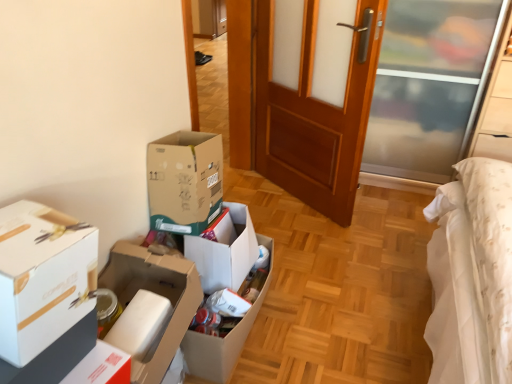
Measure the distance between white cardboard box at center, positioned as the 2th box in back-to-front order, and camera.

They are 1.10 meters apart.

Identify the location of white cardboard box at center, the second box when ordered from front to back. (150, 306).

Could you tell me if white cardboard box at left, which is the third box in back-to-front order, is facing white cardboard box at center, positioned as the 2th box in back-to-front order?

No, white cardboard box at left, which is the third box in back-to-front order, is not oriented towards white cardboard box at center, positioned as the 2th box in back-to-front order.

Considering the positions of objects white cardboard box at left, the first box from the front, and white cardboard box at center, the second box when ordered from front to back, in the image provided, who is behind, white cardboard box at left, the first box from the front, or white cardboard box at center, the second box when ordered from front to back,?

white cardboard box at center, the second box when ordered from front to back, is further away from the camera.

Is white cardboard box at left, the first box from the front, touching white cardboard box at center, the second box when ordered from front to back?

white cardboard box at left, the first box from the front, is not next to white cardboard box at center, the second box when ordered from front to back, and they're not touching.

Considering the positions of objects white cardboard box at left, the first box from the front, and white cardboard box at center, positioned as the 2th box in back-to-front order, in the image provided, who is more to the left, white cardboard box at left, the first box from the front, or white cardboard box at center, positioned as the 2th box in back-to-front order,?

From the viewer's perspective, white cardboard box at left, the first box from the front, appears more on the left side.

I want to click on box that is the 1st one above the cardboard box at center, positioned as the third box in front-to-back order (from a real-world perspective), so click(x=150, y=306).

Is cardboard box at center, the first box when ordered from back to front, at the back of white cardboard box at center, the second box when ordered from front to back?

No.

Is white cardboard box at center, positioned as the 2th box in back-to-front order, inside the boundaries of cardboard box at center, positioned as the third box in front-to-back order, or outside?

white cardboard box at center, positioned as the 2th box in back-to-front order, is spatially situated outside cardboard box at center, positioned as the third box in front-to-back order.

Is point (143, 380) closer to viewer compared to point (182, 342)?

That is True.

Is there a large distance between white cardboard box at center, positioned as the 2th box in back-to-front order, and wooden door at center?

Yes, white cardboard box at center, positioned as the 2th box in back-to-front order, and wooden door at center are located far from each other.

Is point (127, 242) more distant than point (281, 48)?

No, it is not.

Is white cardboard box at center, positioned as the 2th box in back-to-front order, wider than wooden door at center?

Yes.

Which is more to the right, white cardboard box at left, the first box from the front, or cardboard box at center, positioned as the third box in front-to-back order?

Positioned to the right is cardboard box at center, positioned as the third box in front-to-back order.

Considering the relative positions of white cardboard box at left, the first box from the front, and cardboard box at center, positioned as the third box in front-to-back order, in the image provided, is white cardboard box at left, the first box from the front, in front of cardboard box at center, positioned as the third box in front-to-back order,?

Yes, the depth of white cardboard box at left, the first box from the front, is less than that of cardboard box at center, positioned as the third box in front-to-back order.

Is white cardboard box at left, which is the third box in back-to-front order, thinner than cardboard box at center, the first box when ordered from back to front?

Yes.

From their relative heights in the image, would you say wooden door at center is taller or shorter than white cardboard box at center, positioned as the 2th box in back-to-front order?

Considering their sizes, wooden door at center has more height than white cardboard box at center, positioned as the 2th box in back-to-front order.

Who is more distant, wooden door at center or white cardboard box at center, positioned as the 2th box in back-to-front order?

Positioned behind is wooden door at center.

Which object is positioned more to the left, wooden door at center or white cardboard box at center, the second box when ordered from front to back?

Positioned to the left is white cardboard box at center, the second box when ordered from front to back.

Which of these two, cardboard box at center, positioned as the third box in front-to-back order, or white cardboard box at center, positioned as the 2th box in back-to-front order, stands taller?

cardboard box at center, positioned as the third box in front-to-back order.

From a real-world perspective, which is physically above, cardboard box at center, the first box when ordered from back to front, or white cardboard box at center, the second box when ordered from front to back?

From a 3D spatial view, white cardboard box at center, the second box when ordered from front to back, is above.

From the image's perspective, is cardboard box at center, the first box when ordered from back to front, under white cardboard box at center, positioned as the 2th box in back-to-front order?

Yes, from the image's perspective, cardboard box at center, the first box when ordered from back to front, is beneath white cardboard box at center, positioned as the 2th box in back-to-front order.

How many degrees apart are the facing directions of cardboard box at center, the first box when ordered from back to front, and white cardboard box at center, the second box when ordered from front to back?

cardboard box at center, the first box when ordered from back to front, and white cardboard box at center, the second box when ordered from front to back, are facing 8.49e-05 degrees away from each other.

Could you tell me if cardboard box at center, the first box when ordered from back to front, is turned towards wooden door at center?

No, cardboard box at center, the first box when ordered from back to front, is not oriented towards wooden door at center.

Does cardboard box at center, positioned as the third box in front-to-back order, come behind wooden door at center?

That is False.

Can we say cardboard box at center, positioned as the third box in front-to-back order, lies outside wooden door at center?

Indeed, cardboard box at center, positioned as the third box in front-to-back order, is completely outside wooden door at center.

What are the coordinates of `the 1st box to the right of the white cardboard box at left, the first box from the front, counting from the anchor's position` in the screenshot? It's located at (150, 306).

Where is `box lying below the white cardboard box at center, positioned as the 2th box in back-to-front order (from the image's perspective)`? box lying below the white cardboard box at center, positioned as the 2th box in back-to-front order (from the image's perspective) is located at coordinates (223, 338).

Estimate the real-world distances between objects in this image. Which object is further from white cardboard box at center, the second box when ordered from front to back, cardboard box at center, the first box when ordered from back to front, or wooden door at center?

wooden door at center lies further to white cardboard box at center, the second box when ordered from front to back, than the other object.

Considering their positions, is cardboard box at center, the first box when ordered from back to front, positioned further to wooden door at center than white cardboard box at center, positioned as the 2th box in back-to-front order?

white cardboard box at center, positioned as the 2th box in back-to-front order, is further to wooden door at center.

Consider the image. Estimate the real-world distances between objects in this image. Which object is closer to white cardboard box at center, positioned as the 2th box in back-to-front order, wooden door at center or white cardboard box at left, which is the third box in back-to-front order?

white cardboard box at left, which is the third box in back-to-front order, is positioned closer to the anchor white cardboard box at center, positioned as the 2th box in back-to-front order.

From the image, which object appears to be nearer to cardboard box at center, positioned as the third box in front-to-back order, wooden door at center or white cardboard box at left, which is the third box in back-to-front order?

The object closer to cardboard box at center, positioned as the third box in front-to-back order, is white cardboard box at left, which is the third box in back-to-front order.

Considering their positions, is wooden door at center positioned closer to white cardboard box at left, the first box from the front, than cardboard box at center, positioned as the third box in front-to-back order?

The object closer to white cardboard box at left, the first box from the front, is cardboard box at center, positioned as the third box in front-to-back order.

When comparing their distances from white cardboard box at center, positioned as the 2th box in back-to-front order, does white cardboard box at left, the first box from the front, or cardboard box at center, the first box when ordered from back to front, seem closer?

cardboard box at center, the first box when ordered from back to front, is closer to white cardboard box at center, positioned as the 2th box in back-to-front order.

Looking at the image, which one is located further to wooden door at center, cardboard box at center, positioned as the third box in front-to-back order, or white cardboard box at left, the first box from the front?

white cardboard box at left, the first box from the front, lies further to wooden door at center than the other object.

Which object lies nearer to the anchor point white cardboard box at left, the first box from the front, wooden door at center or white cardboard box at center, the second box when ordered from front to back?

white cardboard box at center, the second box when ordered from front to back, lies closer to white cardboard box at left, the first box from the front, than the other object.

Locate an element on the screen. This screenshot has width=512, height=384. box between white cardboard box at left, the first box from the front, and cardboard box at center, positioned as the third box in front-to-back order, from front to back is located at coordinates (150, 306).